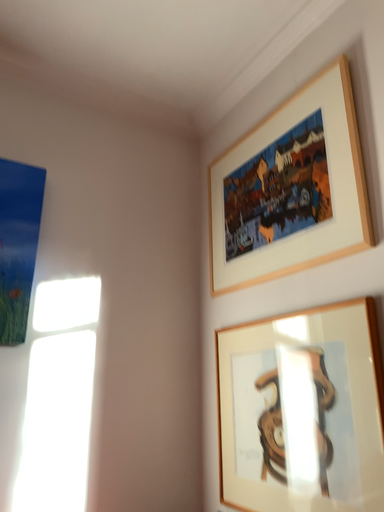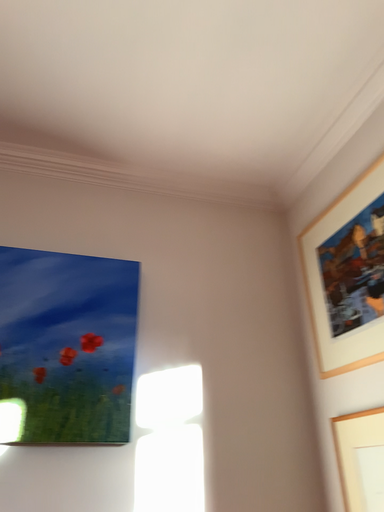
Question: How did the camera likely rotate when shooting the video?

Choices:
 (A) rotated left
 (B) rotated right

Answer: (A)